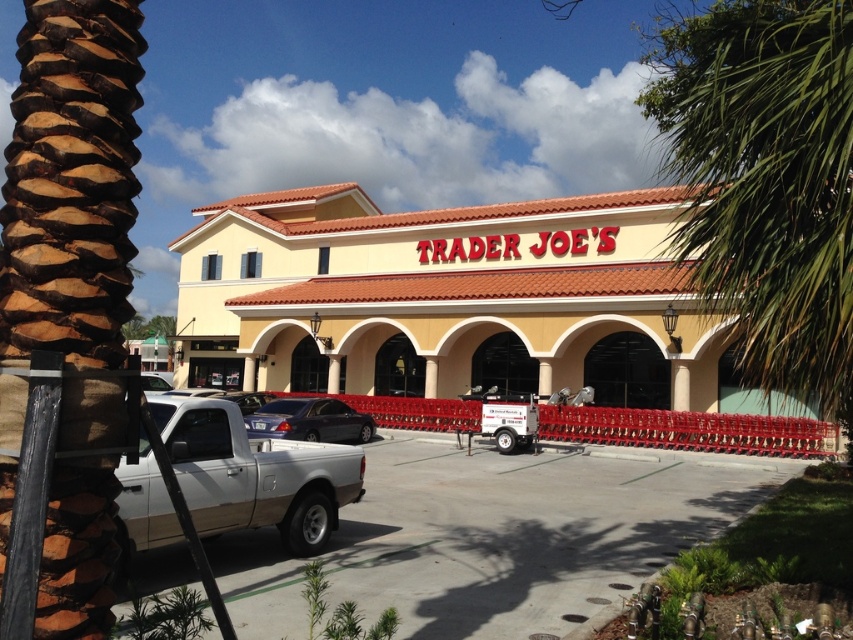
Question: Does brown textured palm tree at left come behind satin black sedan at center?

Choices:
 (A) yes
 (B) no

Answer: (B)

Question: Based on their relative distances, which object is nearer to the green leafy palm tree at upper right?

Choices:
 (A) brown textured palm tree at left
 (B) yellow stucco building at center

Answer: (B)

Question: Based on their relative distances, which object is farther from the satin black sedan at center?

Choices:
 (A) yellow stucco building at center
 (B) brown textured palm tree at left

Answer: (B)

Question: Is white matte truck at lower left smaller than satin black sedan at center?

Choices:
 (A) no
 (B) yes

Answer: (B)

Question: Does white matte truck at lower left have a larger size compared to satin black sedan at center?

Choices:
 (A) no
 (B) yes

Answer: (A)

Question: Which point is farther from the camera taking this photo?

Choices:
 (A) (328, 400)
 (B) (772, 184)
 (C) (59, 568)
 (D) (221, 506)

Answer: (A)